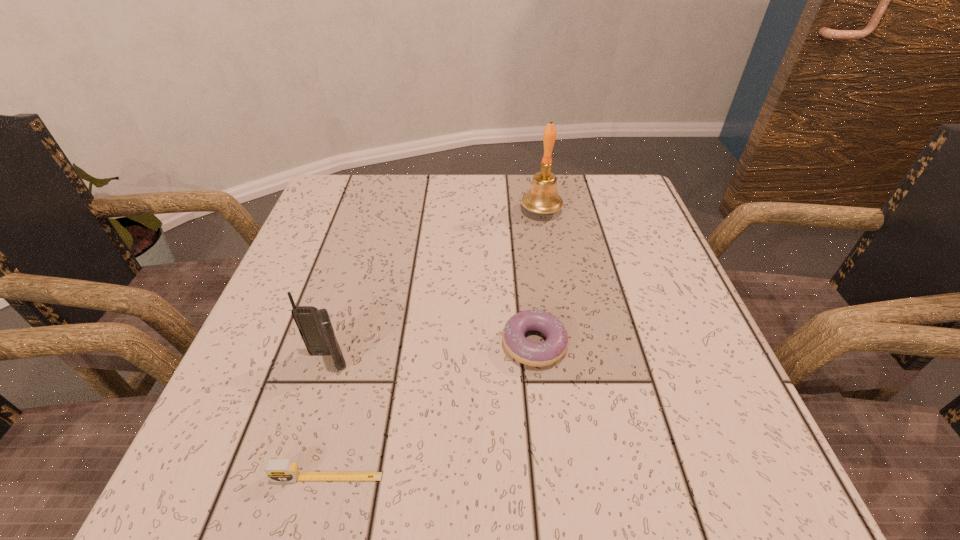
Identify the location of the farthest object. The image size is (960, 540). (542, 198).

Find the location of a particular element. Image resolution: width=960 pixels, height=540 pixels. the tallest object is located at coordinates (542, 198).

This screenshot has width=960, height=540. Find the location of `cellular telephone`. cellular telephone is located at coordinates (315, 327).

The width and height of the screenshot is (960, 540). Identify the location of doughnut. (550, 351).

The image size is (960, 540). Find the location of `tape measure`. tape measure is located at coordinates (277, 470).

Find the location of a particular element. The image size is (960, 540). vacant region located on the right of the farthest object is located at coordinates 640,211.

At what (x,y) coordinates should I click in order to perform the action: click on free region located on the keyboard of the cellular telephone. Please return your answer as a coordinate pair (x, y). This screenshot has height=540, width=960. Looking at the image, I should click on (292, 478).

Locate an element on the screen. This screenshot has width=960, height=540. blank space located on the front of the doughnut is located at coordinates (546, 447).

Identify the location of object positioned at the far edge. (542, 198).

This screenshot has height=540, width=960. Find the location of `object present at the near edge`. object present at the near edge is located at coordinates (277, 470).